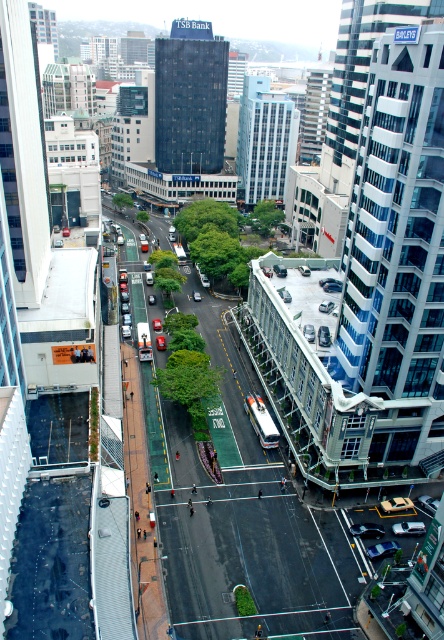
Question: Does metallic silver car at lower right have a lesser width compared to sleek silver sedan at center?

Choices:
 (A) no
 (B) yes

Answer: (A)

Question: Which object is farther from the camera taking this photo?

Choices:
 (A) sleek silver sedan at center
 (B) metallic silver car at lower right

Answer: (A)

Question: Can you confirm if shiny silver sedan at center is positioned to the right of sleek silver sedan at center?

Choices:
 (A) no
 (B) yes

Answer: (A)

Question: Can you confirm if metallic silver car at lower right is positioned to the left of sleek silver sedan at center?

Choices:
 (A) yes
 (B) no

Answer: (A)

Question: Which is farther from the shiny silver sedan at center?

Choices:
 (A) metallic silver car at lower right
 (B) sleek silver sedan at center

Answer: (B)

Question: Which object is positioned closest to the sleek silver sedan at center?

Choices:
 (A) shiny silver sedan at center
 (B) metallic silver car at lower right

Answer: (A)